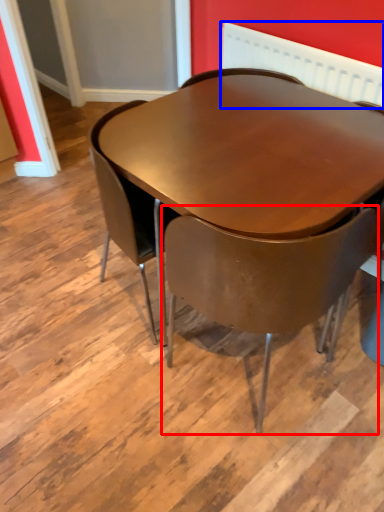
Question: Which object appears closest to the camera in this image, chair (highlighted by a red box) or radiator (highlighted by a blue box)?

Choices:
 (A) chair
 (B) radiator

Answer: (A)